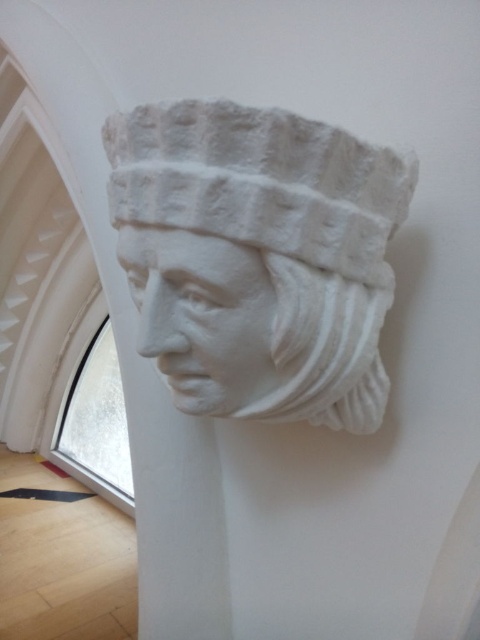
You are an art conservator examining the sculpture arrangement. You notice two white stone pieces, the white stone bust at upper center and the white stone sculpture at center. Which one is placed higher up?

The white stone bust at upper center is positioned over the white stone sculpture at center, so it is placed higher up.

You are an art conservator working on a restoration project. You need to place a protective barrier between the white stone bust at upper center and the white stone sculpture at center to prevent damage during transport. Given that the barrier must be at least 2 inches thick, will it fit in the space between them?

The white stone bust at upper center is 1.75 inches away from the white stone sculpture at center. Since the barrier requires 2 inches of space and the available space is less than that, the barrier cannot be placed between them.

You are an architect analyzing the placement of a new light fixture. You need to place it at point [257,257]. What object will be directly illuminated by this light?

The white stone bust at upper center is located at point [257,257], so the light will directly illuminate the white stone bust at upper center.